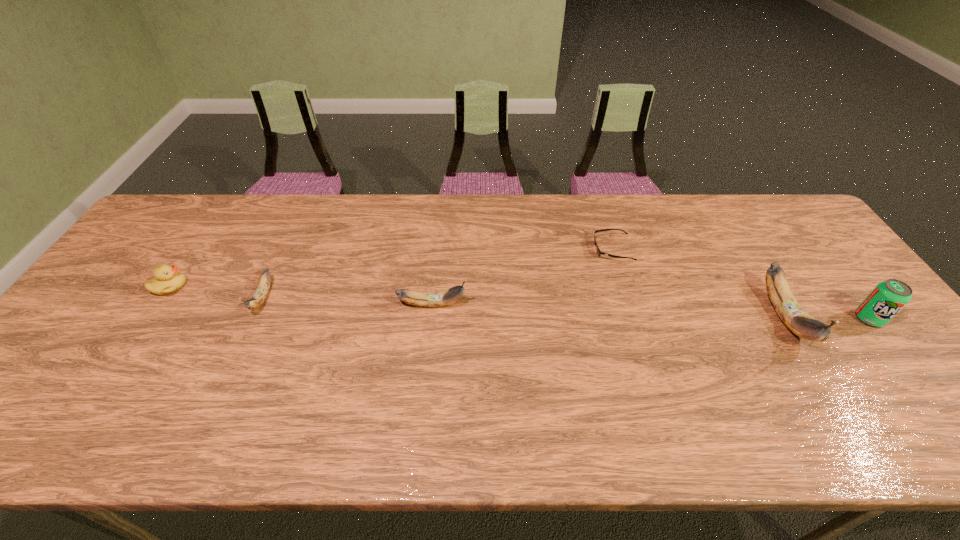
The width and height of the screenshot is (960, 540). What are the coordinates of `vacant area between the leftmost object and the leftmost banana` in the screenshot? It's located at (216, 292).

Where is `empty space that is in between the tallest banana and the third object from left to right`? This screenshot has width=960, height=540. empty space that is in between the tallest banana and the third object from left to right is located at coordinates (609, 310).

Find the location of a particular element. free space between the second banana from left to right and the shortest banana is located at coordinates (348, 301).

Find the location of a particular element. The height and width of the screenshot is (540, 960). unoccupied area between the leftmost banana and the fifth object from left to right is located at coordinates (523, 307).

Find the location of `unoccupied position between the leftmost object and the sunglasses`. unoccupied position between the leftmost object and the sunglasses is located at coordinates (391, 268).

Locate an element on the screen. This screenshot has height=540, width=960. free point between the second banana from left to right and the tallest banana is located at coordinates (609, 310).

Find the location of a particular element. The height and width of the screenshot is (540, 960). free space between the third object from right to left and the tallest object is located at coordinates (698, 283).

Locate an element on the screen. This screenshot has width=960, height=540. free space that is in between the leftmost banana and the fourth shortest object is located at coordinates (348, 301).

Where is `free space between the rightmost banana and the pop soda`? The width and height of the screenshot is (960, 540). free space between the rightmost banana and the pop soda is located at coordinates (827, 318).

Find the location of `object that stands as the third closest to the rightmost object`. object that stands as the third closest to the rightmost object is located at coordinates (440, 298).